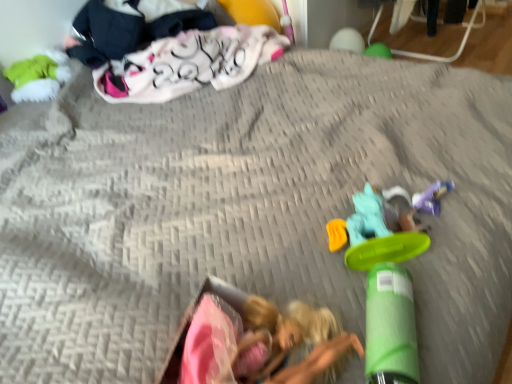
Question: From a real-world perspective, relative to fluffy pink blanket at upper left, the second clothing viewed from the left, is green matte cylinder at lower right, the 3th toy when ordered from right to left, vertically above or below?

Choices:
 (A) below
 (B) above

Answer: (A)

Question: Would you say green matte cylinder at lower right, which is the 4th toy from back to front, is inside or outside fluffy pink blanket at upper left, the second clothing viewed from the left?

Choices:
 (A) outside
 (B) inside

Answer: (A)

Question: Which object is positioned closest to the translucent plastic toy at center, which ranks as the third toy in back-to-front order?

Choices:
 (A) matte green plush at upper left, positioned as the 4th toy in front-to-back order
 (B) green matte cylinder at lower right, the 3th toy when ordered from right to left
 (C) dark blue fabric at upper left, acting as the 1th clothing starting from the left
 (D) purple plastic toy at lower right, marked as the third toy in a bottom-to-top arrangement
 (E) fluffy pink blanket at upper left, the second clothing viewed from the left

Answer: (D)

Question: Which of these objects is positioned farthest from the fluffy pink blanket at upper left, marked as the first clothing in a right-to-left arrangement?

Choices:
 (A) purple plastic toy at lower right, which is counted as the first toy, starting from the right
 (B) green matte cylinder at lower right, the 3th toy when ordered from right to left
 (C) dark blue fabric at upper left, acting as the 1th clothing starting from the left
 (D) translucent plastic toy at center, arranged as the 3th toy when viewed from the top
 (E) matte green plush at upper left, the 1th toy from the back

Answer: (B)